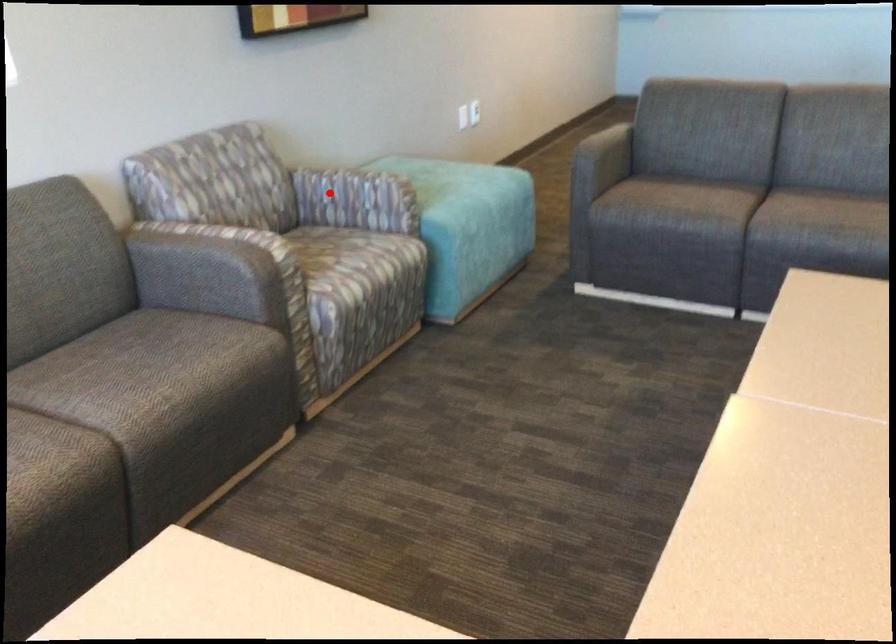
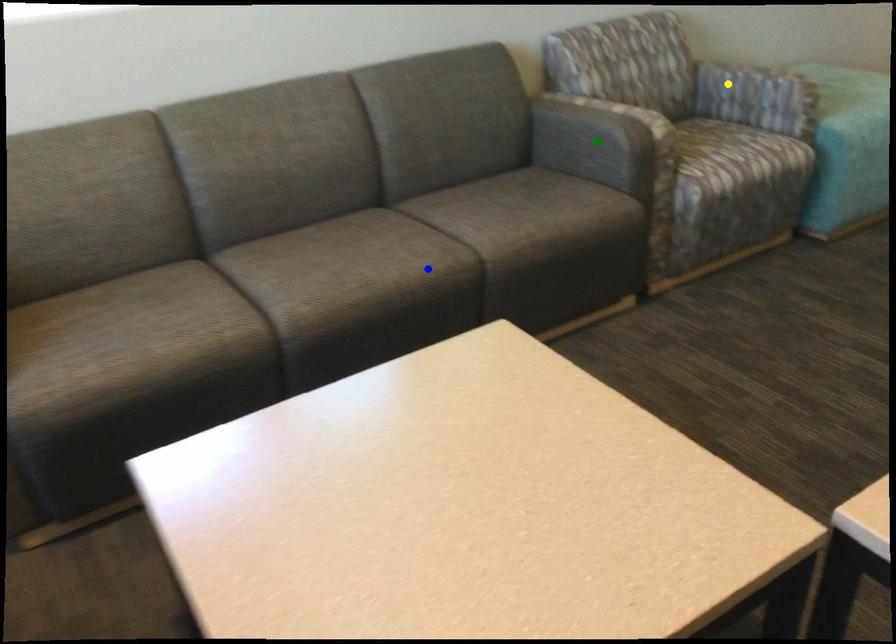
Question: I am providing you with two images of the same scene from different viewpoints. A red point is marked on the first image. You are given multiple points on the second image. Can you choose the point in image 2 that corresponds to the point in image 1?

Choices:
 (A) yellow point
 (B) green point
 (C) blue point

Answer: (A)